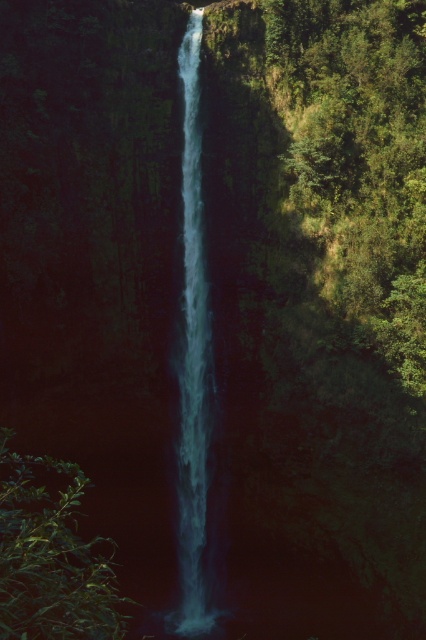
You are standing at the edge of a cliff overlooking the waterfall. You see the green leafy vegetation at right and the clear blue water at center. Which object is closer to you?

The green leafy vegetation at right is closer to the viewer than the clear blue water at center.

You are standing at the base of the waterfall and want to reach a specific point marked by coordinates. Which of the two points, point (307,108) or point (198,406), is closer to you?

Point (198,406) is closer to you because it is in front of point (307,108).

You are standing at the point with coordinates point (359, 160) and want to move towards the waterfall. Which direction should you go to avoid the green leafy vegetation at right?

Since the green leafy vegetation at right is located to the right of point (359, 160), you should move to the left to avoid it and head towards the waterfall.